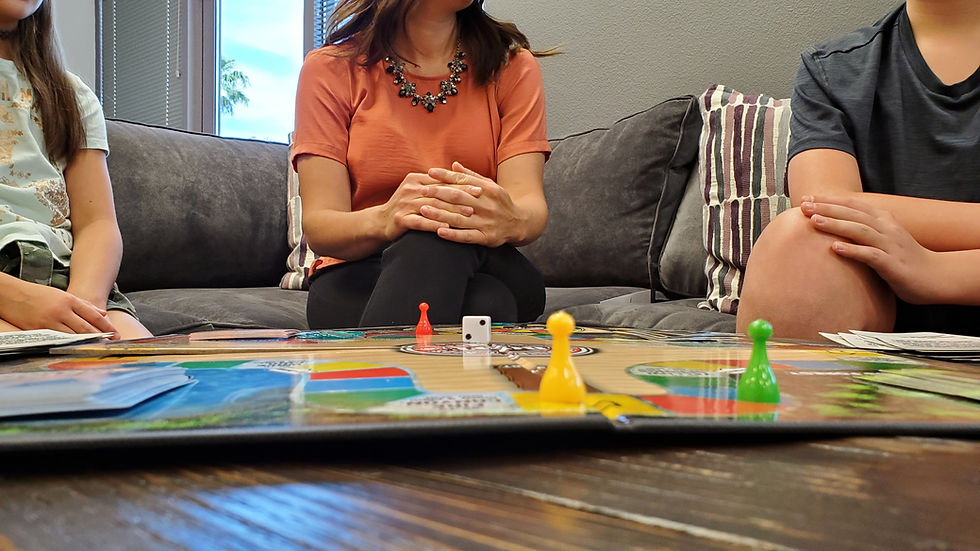
Where is `wooden tabletop`? This screenshot has width=980, height=551. wooden tabletop is located at coordinates (407, 529).